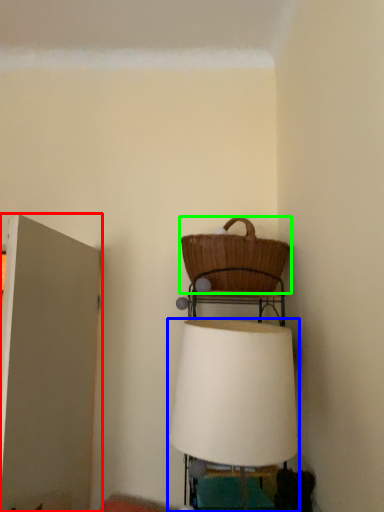
Question: Based on their relative distances, which object is nearer to door (highlighted by a red box)? Choose from lamp (highlighted by a blue box) and picnic basket (highlighted by a green box).

Choices:
 (A) lamp
 (B) picnic basket

Answer: (B)